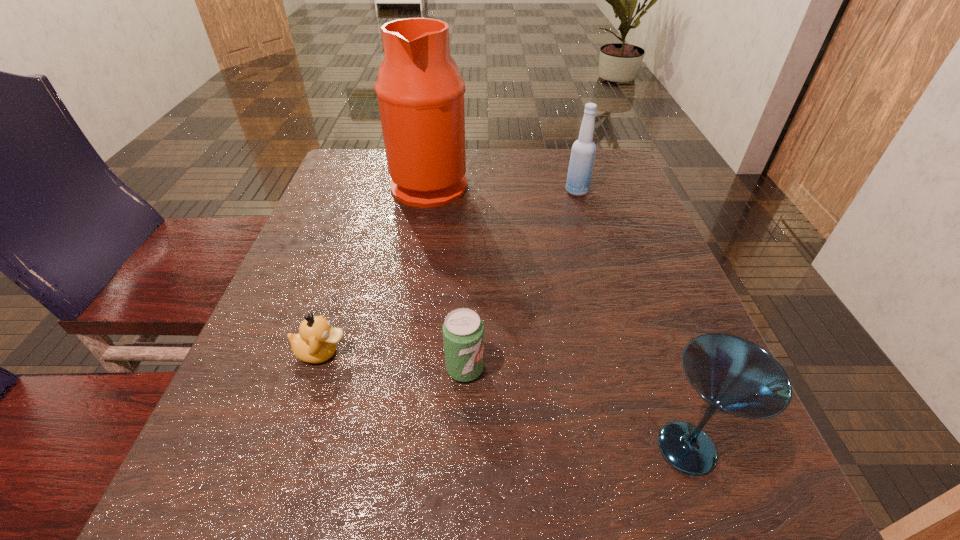
In order to click on water jug in this screenshot , I will do `click(420, 92)`.

The height and width of the screenshot is (540, 960). Find the location of `the second tallest object`. the second tallest object is located at coordinates (583, 151).

The width and height of the screenshot is (960, 540). What are the coordinates of `the third tallest object` in the screenshot? It's located at (734, 376).

The width and height of the screenshot is (960, 540). What are the coordinates of `the nearest object` in the screenshot? It's located at (734, 376).

The image size is (960, 540). In order to click on soda in this screenshot , I will do `click(463, 331)`.

Where is `the shortest object`? This screenshot has width=960, height=540. the shortest object is located at coordinates (316, 342).

The height and width of the screenshot is (540, 960). What are the coordinates of `free space located from the spout of the tallest object` in the screenshot? It's located at (527, 184).

You are a GUI agent. You are given a task and a screenshot of the screen. Output one action in this format:
    pyautogui.click(x=<x>, y=<y>)
    Task: Click on the vacant point located on the front of the second tallest object
    The width and height of the screenshot is (960, 540).
    Given the screenshot: What is the action you would take?
    pyautogui.click(x=601, y=273)

Image resolution: width=960 pixels, height=540 pixels. Find the location of `free point located on the front of the martini`. free point located on the front of the martini is located at coordinates (717, 534).

This screenshot has width=960, height=540. What are the coordinates of `free space located on the right of the soda` in the screenshot? It's located at (597, 369).